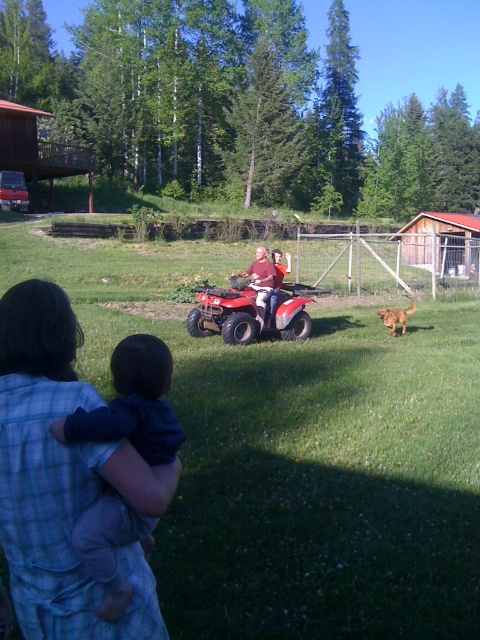
Consider the image. Who is shorter, dark blue fabric baby at lower left or golden fur dog at right?

golden fur dog at right is shorter.

Who is positioned more to the left, dark blue fabric baby at lower left or golden fur dog at right?

dark blue fabric baby at lower left

Between point (155, 371) and point (412, 312), which one is positioned behind?

The point (412, 312) is more distant.

At what (x,y) coordinates should I click in order to perform the action: click on dark blue fabric baby at lower left. Please return your answer as a coordinate pair (x, y). Image resolution: width=480 pixels, height=640 pixels. Looking at the image, I should click on (132, 404).

Looking at this image, does dark blue fabric baby at lower left have a larger size compared to matte red quad bike at center?

Actually, dark blue fabric baby at lower left might be smaller than matte red quad bike at center.

Is dark blue fabric baby at lower left positioned before matte red quad bike at center?

Yes, dark blue fabric baby at lower left is closer to the viewer.

Find the location of a particular element. The height and width of the screenshot is (640, 480). dark blue fabric baby at lower left is located at coordinates (132, 404).

Is green grass at center positioned before dark blue fabric baby at lower left?

No, it is behind dark blue fabric baby at lower left.

Identify the location of green grass at center. (297, 454).

You are a GUI agent. You are given a task and a screenshot of the screen. Output one action in this format:
    pyautogui.click(x=<x>, y=<y>)
    Task: Click on the green grass at center
    This screenshot has width=480, height=640.
    Given the screenshot: What is the action you would take?
    pyautogui.click(x=297, y=454)